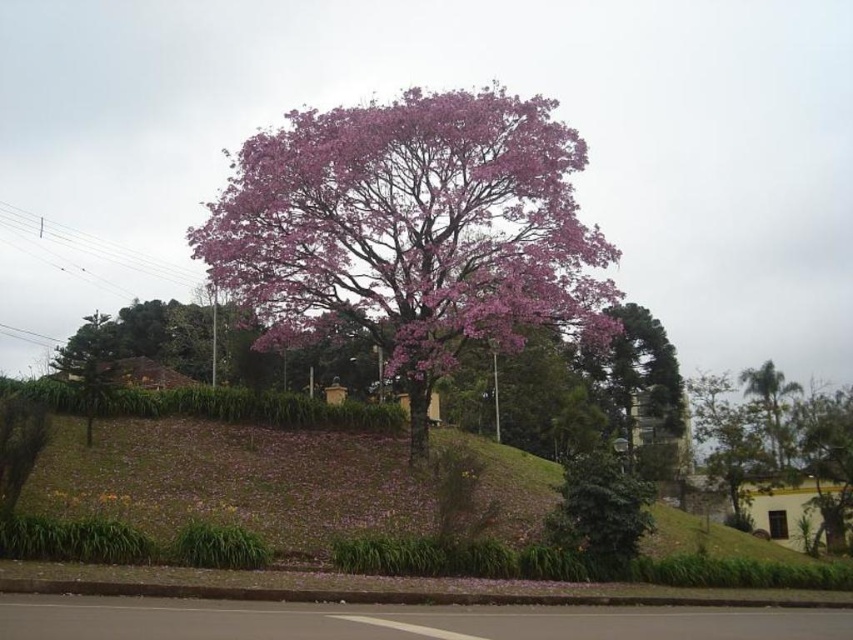
Question: Can you confirm if pink matte tree at center is thinner than green leafy palm at right?

Choices:
 (A) no
 (B) yes

Answer: (A)

Question: Which of the following is the farthest from the observer?

Choices:
 (A) (741, 390)
 (B) (618, 296)

Answer: (A)

Question: Can you confirm if pink matte tree at center is bigger than green leafy palm at right?

Choices:
 (A) yes
 (B) no

Answer: (A)

Question: Can you confirm if pink matte tree at center is positioned to the left of green leafy palm at right?

Choices:
 (A) no
 (B) yes

Answer: (B)

Question: Which of the following is the farthest from the observer?

Choices:
 (A) pink matte tree at center
 (B) green leafy palm at right

Answer: (B)

Question: Which point is farther from the camera taking this photo?

Choices:
 (A) (483, 314)
 (B) (775, 458)

Answer: (B)